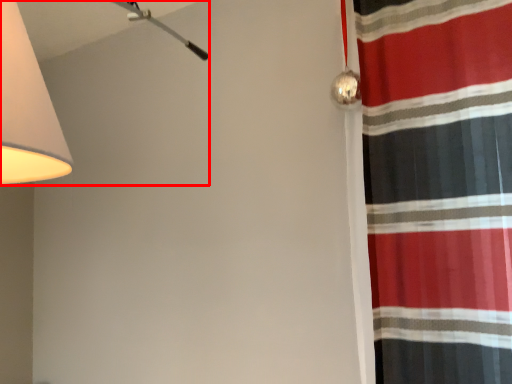
Question: Where is lamp (annotated by the red box) located in relation to curtain in the image?

Choices:
 (A) left
 (B) right

Answer: (A)